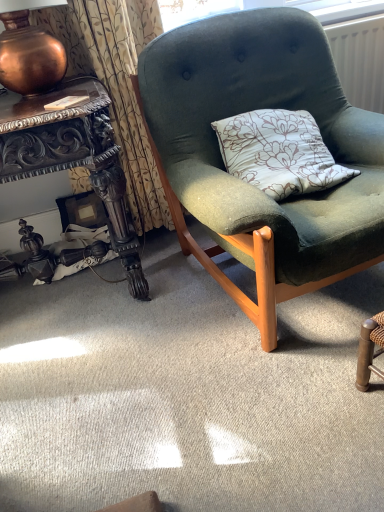
The height and width of the screenshot is (512, 384). Describe the element at coordinates (360, 60) in the screenshot. I see `white plastic radiator at upper right` at that location.

Where is `textured beige curtain at upper left`? textured beige curtain at upper left is located at coordinates (116, 84).

From the image's perspective, between polished dark wood desk at left and copper metallic lamp at upper left, who is located below?

From the image's view, polished dark wood desk at left is below.

Can you confirm if polished dark wood desk at left is positioned to the left of copper metallic lamp at upper left?

Correct, you'll find polished dark wood desk at left to the left of copper metallic lamp at upper left.

Looking at this image, what's the angular difference between polished dark wood desk at left and copper metallic lamp at upper left's facing directions?

They differ by 0.719 degrees in their facing directions.

Which of these two, polished dark wood desk at left or copper metallic lamp at upper left, stands taller?

With more height is polished dark wood desk at left.

From a real-world perspective, between copper metallic lamp at upper left and velvet green chair at center, who is vertically lower?

velvet green chair at center, from a real-world perspective.

Is copper metallic lamp at upper left outside of velvet green chair at center?

Yes, copper metallic lamp at upper left is outside of velvet green chair at center.

Is copper metallic lamp at upper left turned away from velvet green chair at center?

That's not correct — copper metallic lamp at upper left is not looking away from velvet green chair at center.

Are copper metallic lamp at upper left and velvet green chair at center beside each other?

No.

Is velvet green chair at center facing away from white plastic radiator at upper right?

No, velvet green chair at center is not facing the opposite direction of white plastic radiator at upper right.

This screenshot has height=512, width=384. There is a velvet green chair at center. Find the location of `radiator above it (from a real-world perspective)`. radiator above it (from a real-world perspective) is located at coordinates (360, 60).

Is white plastic radiator at upper right inside velvet green chair at center?

Actually, white plastic radiator at upper right is outside velvet green chair at center.

From a real-world perspective, between velvet green chair at center and white plastic radiator at upper right, who is vertically lower?

velvet green chair at center is physically lower.

Do you think white plastic radiator at upper right is within copper metallic lamp at upper left, or outside of it?

white plastic radiator at upper right cannot be found inside copper metallic lamp at upper left.

Considering the relative positions of white plastic radiator at upper right and copper metallic lamp at upper left in the image provided, is white plastic radiator at upper right behind copper metallic lamp at upper left?

Yes, the depth of white plastic radiator at upper right is greater than that of copper metallic lamp at upper left.

Is white plastic radiator at upper right taller or shorter than copper metallic lamp at upper left?

In the image, white plastic radiator at upper right appears to be taller than copper metallic lamp at upper left.

Could you tell me if white plastic radiator at upper right is turned towards copper metallic lamp at upper left?

No, white plastic radiator at upper right does not turn towards copper metallic lamp at upper left.

Does point (132, 274) come behind point (214, 181)?

Yes, it is.

Based on their positions, is polished dark wood desk at left located to the left or right of velvet green chair at center?

Clearly, polished dark wood desk at left is on the left of velvet green chair at center in the image.

Identify the location of desk on the left of velvet green chair at center. This screenshot has height=512, width=384. (69, 168).

From the image's perspective, which one is positioned lower, polished dark wood desk at left or velvet green chair at center?

From the image's view, polished dark wood desk at left is below.

Is copper metallic lamp at upper left thinner than polished dark wood desk at left?

Indeed, copper metallic lamp at upper left has a lesser width compared to polished dark wood desk at left.

Do you think copper metallic lamp at upper left is within polished dark wood desk at left, or outside of it?

copper metallic lamp at upper left lies outside polished dark wood desk at left.

The width and height of the screenshot is (384, 512). In order to click on desk in front of the copper metallic lamp at upper left in this screenshot , I will do tap(69, 168).

Which is closer, (12, 70) or (35, 239)?

Point (12, 70) is closer to the camera than point (35, 239).

Which object is closer to the camera taking this photo, polished dark wood desk at left or textured beige curtain at upper left?

Positioned in front is polished dark wood desk at left.

From a real-world perspective, is polished dark wood desk at left below textured beige curtain at upper left?

Yes, from a real-world perspective, polished dark wood desk at left is beneath textured beige curtain at upper left.

Where is `desk below the textured beige curtain at upper left (from the image's perspective)`? desk below the textured beige curtain at upper left (from the image's perspective) is located at coordinates (69, 168).

From the image's perspective, is polished dark wood desk at left beneath textured beige curtain at upper left?

Yes, from the image's perspective, polished dark wood desk at left is beneath textured beige curtain at upper left.

In order to click on desk on the left of copper metallic lamp at upper left in this screenshot , I will do `click(69, 168)`.

What are the coordinates of `lamp above the velvet green chair at center (from the image's perspective)` in the screenshot? It's located at (29, 53).

Looking at the image, which one is located closer to textured beige curtain at upper left, velvet green chair at center or polished dark wood desk at left?

polished dark wood desk at left.

Which object lies nearer to the anchor point copper metallic lamp at upper left, white plastic radiator at upper right or textured beige curtain at upper left?

Among the two, textured beige curtain at upper left is located nearer to copper metallic lamp at upper left.

Estimate the real-world distances between objects in this image. Which object is closer to polished dark wood desk at left, white plastic radiator at upper right or textured beige curtain at upper left?

Among the two, textured beige curtain at upper left is located nearer to polished dark wood desk at left.

Based on the photo, considering their positions, is copper metallic lamp at upper left positioned further to velvet green chair at center than polished dark wood desk at left?

copper metallic lamp at upper left.

Estimate the real-world distances between objects in this image. Which object is closer to copper metallic lamp at upper left, velvet green chair at center or polished dark wood desk at left?

Among the two, polished dark wood desk at left is located nearer to copper metallic lamp at upper left.

From the image, which object appears to be farther from velvet green chair at center, polished dark wood desk at left or white plastic radiator at upper right?

white plastic radiator at upper right is further to velvet green chair at center.

Looking at the image, which one is located further to copper metallic lamp at upper left, polished dark wood desk at left or white plastic radiator at upper right?

The object further to copper metallic lamp at upper left is white plastic radiator at upper right.

Looking at the image, which one is located further to polished dark wood desk at left, white plastic radiator at upper right or copper metallic lamp at upper left?

Based on the image, white plastic radiator at upper right appears to be further to polished dark wood desk at left.

The height and width of the screenshot is (512, 384). I want to click on chair between textured beige curtain at upper left and white plastic radiator at upper right in the horizontal direction, so click(247, 184).

What are the coordinates of `lamp situated between polished dark wood desk at left and white plastic radiator at upper right from left to right` in the screenshot? It's located at (29, 53).

Find the location of a particular element. lamp situated between polished dark wood desk at left and velvet green chair at center from left to right is located at coordinates (29, 53).

Identify the location of curtain located between copper metallic lamp at upper left and white plastic radiator at upper right in the left-right direction. This screenshot has height=512, width=384. (116, 84).